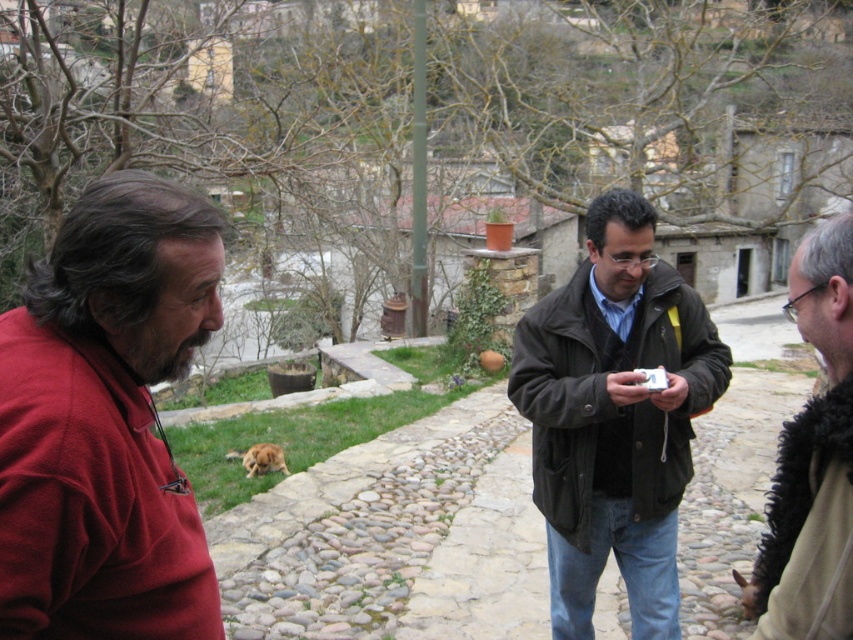
Question: Based on their relative distances, which object is farther from the dark brown leather jacket at center?

Choices:
 (A) matte red shirt at left
 (B) black fuzzy scarf at right

Answer: (A)

Question: Which object is positioned closest to the black fuzzy scarf at right?

Choices:
 (A) dark brown leather jacket at center
 (B) matte red shirt at left

Answer: (A)

Question: Can you confirm if dark brown leather jacket at center is positioned to the right of black fuzzy scarf at right?

Choices:
 (A) yes
 (B) no

Answer: (B)

Question: Is dark brown leather jacket at center wider than black fuzzy scarf at right?

Choices:
 (A) yes
 (B) no

Answer: (B)

Question: Which object is positioned closest to the dark brown leather jacket at center?

Choices:
 (A) matte red shirt at left
 (B) black fuzzy scarf at right

Answer: (B)

Question: From the image, what is the correct spatial relationship of matte red shirt at left in relation to dark brown leather jacket at center?

Choices:
 (A) left
 (B) right

Answer: (A)